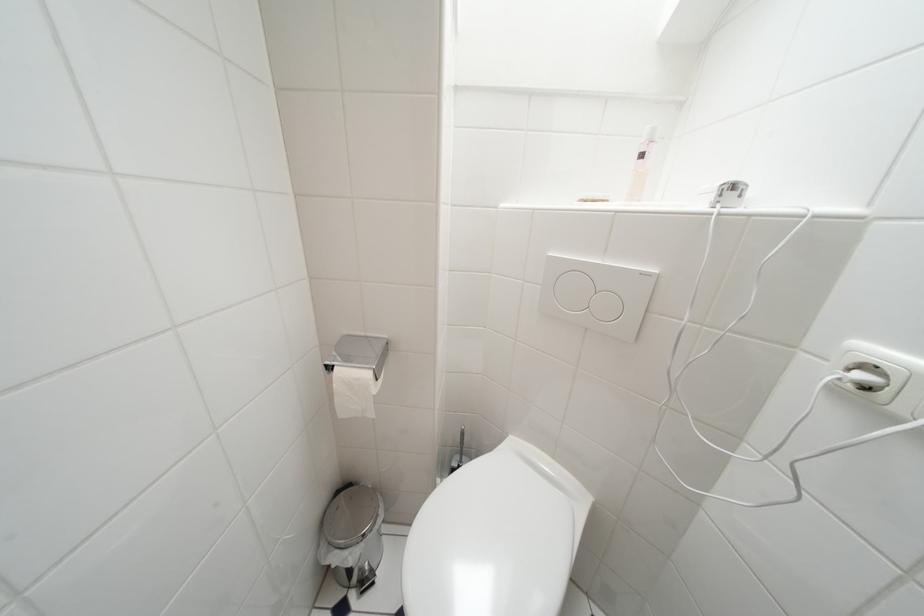
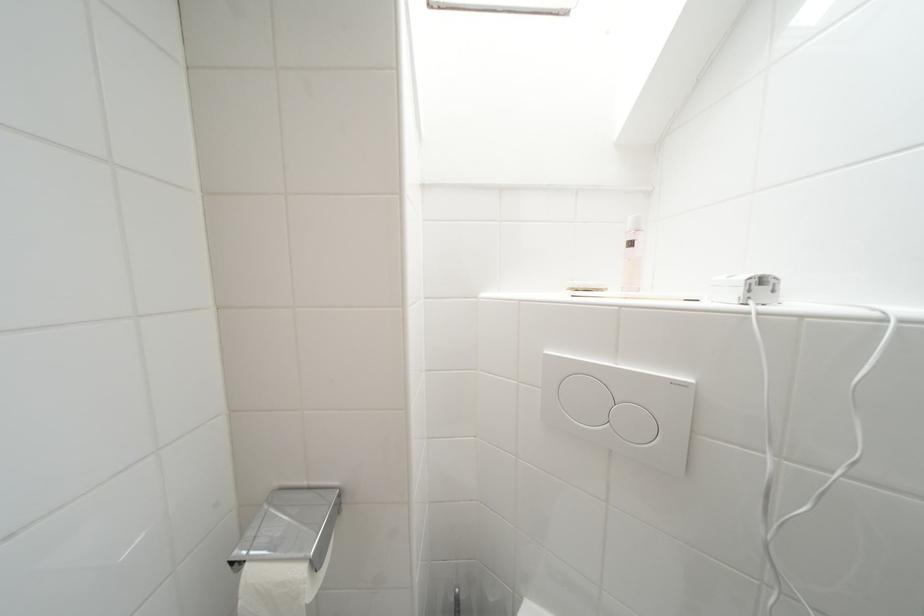
In the second image, find the point that corresponds to (x=739, y=190) in the first image.

(769, 283)